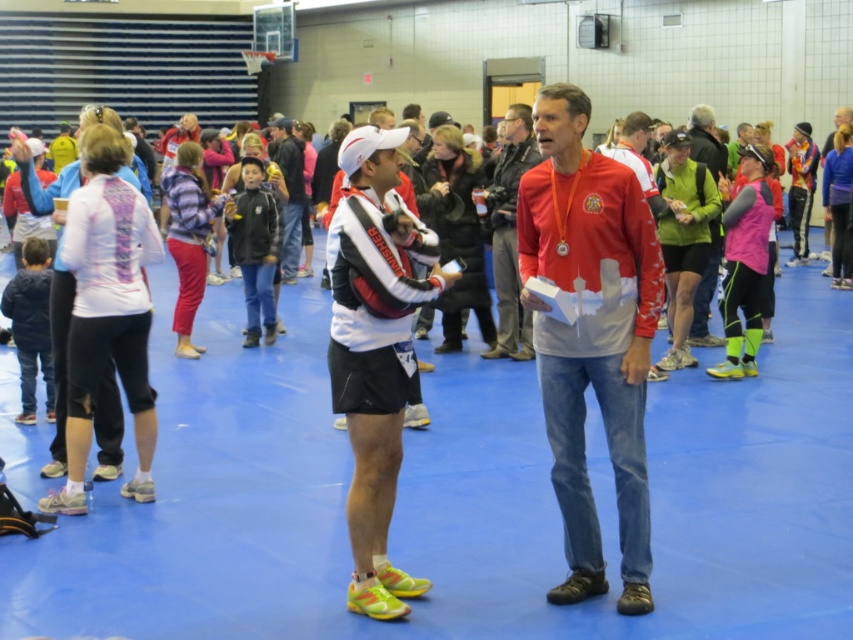
You are standing in the gymnasium and need to place a 30 feet long banner between the matte red shirt at center and dark blue jeans at center. Will the banner be long enough to stretch between them?

The distance between the matte red shirt at center and dark blue jeans at center is 25.99 feet. Since the banner is 30 feet long, it will be long enough to stretch between them with some extra length remaining.

You are at a community event in a gymnasium and see two items at the center of the scene. The items are the red matte jacket at center and the dark blue jeans at center. Which item is positioned to the right?

The red matte jacket at center is positioned to the right of the dark blue jeans at center.